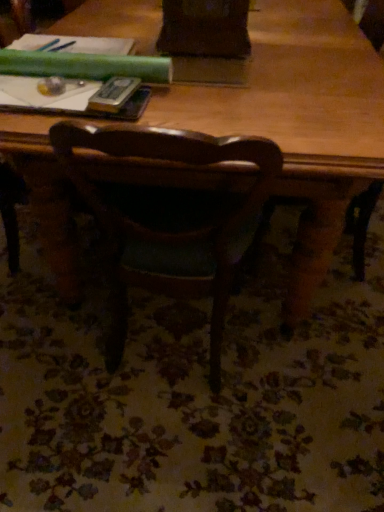
In order to click on vacant space situated on the left part of metallic silver paperback book at upper center in this screenshot , I will do `click(46, 104)`.